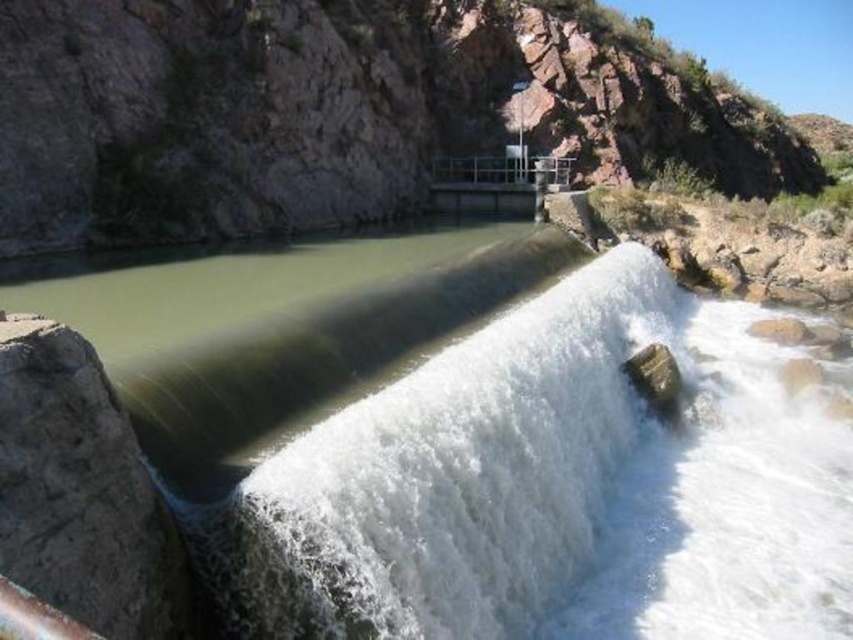
Can you confirm if white frothy water at center is smaller than brown rough stone at lower left?

No.

Is point (553, 582) closer to camera compared to point (148, 637)?

No, (553, 582) is further to viewer.

At what (x,y) coordinates should I click in order to perform the action: click on white frothy water at center. Please return your answer as a coordinate pair (x, y). Looking at the image, I should click on (459, 477).